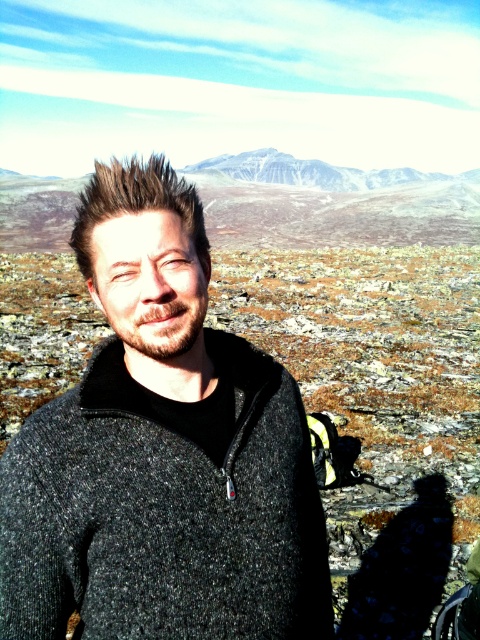
You are a hiker planning to take a photo of the snowy granite mountain at upper center from the location of the charcoal wool sweater at center. Considering the distance between them, would you need a telephoto lens to capture the entire mountain in your shot?

The distance between the charcoal wool sweater at center and the snowy granite mountain at upper center is 90.14 meters. A telephoto lens would help to compress the distance and capture the entire mountain in the frame from that distance.

You are a photographer positioned at a certain distance from the subject wearing the charcoal wool sweater at center. You want to capture a portrait that includes the sweater clearly without any distortion. Given that your camera has a minimum focusing distance of 36 inches, will you be able to take the photo without moving closer?

The distance between the charcoal wool sweater at center and the viewer is 38.23 inches, which is greater than the camera minimum focusing distance of 36 inches. Therefore, you can take the photo without moving closer.

Based on the scene description, where is the charcoal wool sweater at center in relation to the snowy granite mountain at upper center?

The charcoal wool sweater at center is to the left of the snowy granite mountain at upper center.